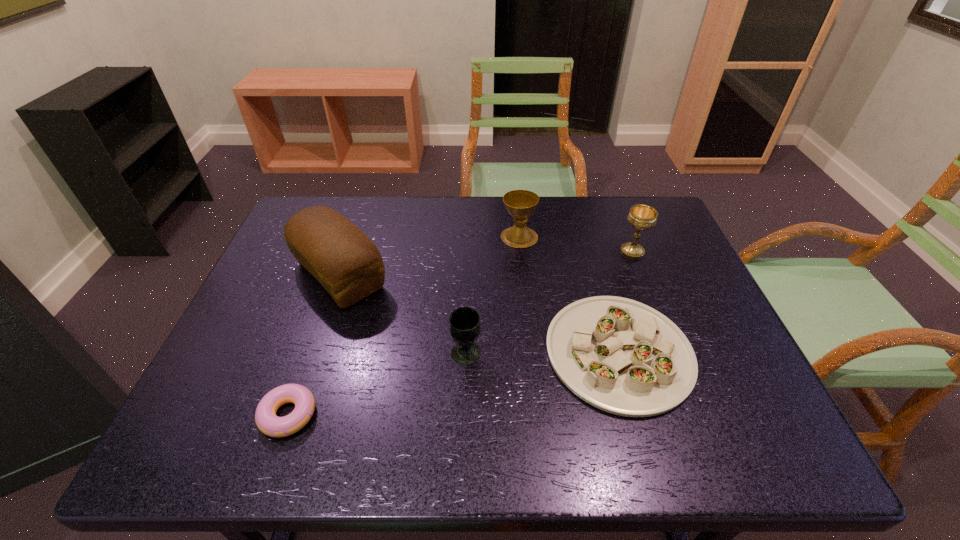
This screenshot has width=960, height=540. What are the coordinates of `chalice that is the second closest to the leftmost chalice` in the screenshot? It's located at (643, 217).

Where is `chalice that is the nearest to the leftmost chalice`? This screenshot has height=540, width=960. chalice that is the nearest to the leftmost chalice is located at coordinates (520, 204).

Locate an element on the screen. The height and width of the screenshot is (540, 960). free spot that satisfies the following two spatial constraints: 1. on the back side of the rightmost chalice; 2. on the left side of the tallest object is located at coordinates (348, 252).

Identify the location of free region that satisfies the following two spatial constraints: 1. on the back side of the fifth tallest object; 2. on the right side of the doughnut. (310, 352).

The width and height of the screenshot is (960, 540). Identify the location of free space that satisfies the following two spatial constraints: 1. on the back side of the shortest object; 2. on the left side of the fourth object from right to left. (310, 354).

Locate an element on the screen. Image resolution: width=960 pixels, height=540 pixels. free spot that satisfies the following two spatial constraints: 1. on the back side of the second chalice from right to left; 2. on the left side of the leftmost chalice is located at coordinates (469, 237).